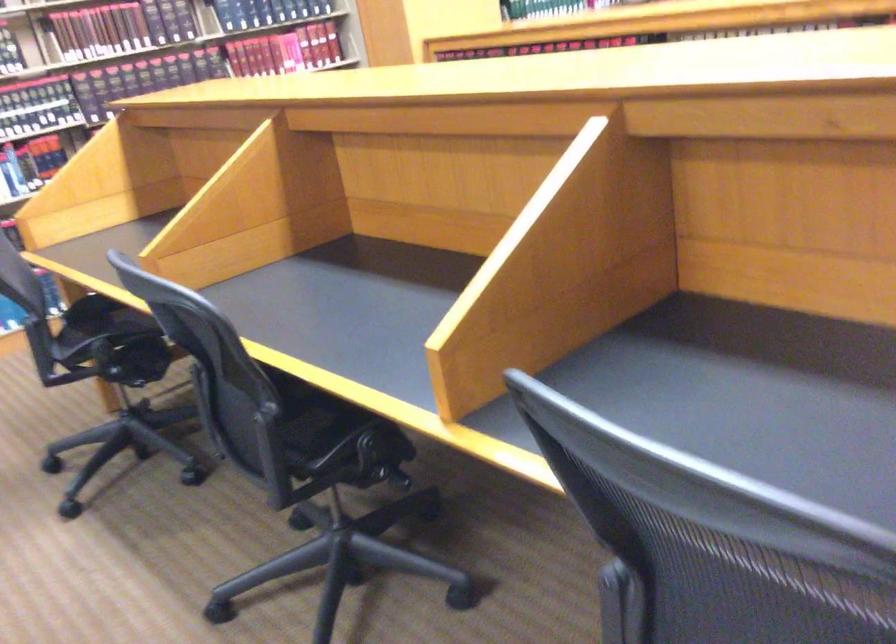
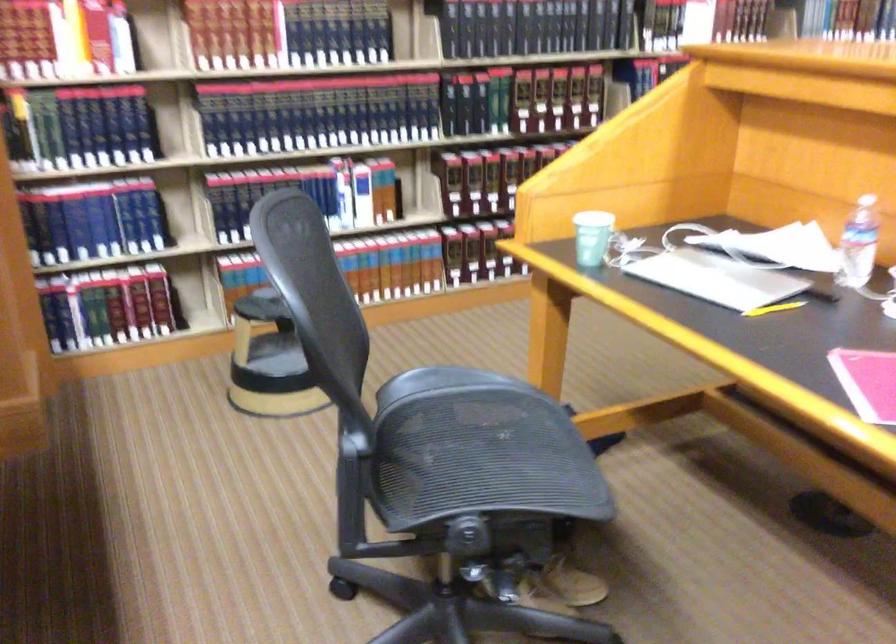
Question: Which direction would the cameraman need to move to produce the second image? Reply with the corresponding letter.

Choices:
 (A) Left
 (B) Right
 (C) Forward
 (D) Backward

Answer: (A)